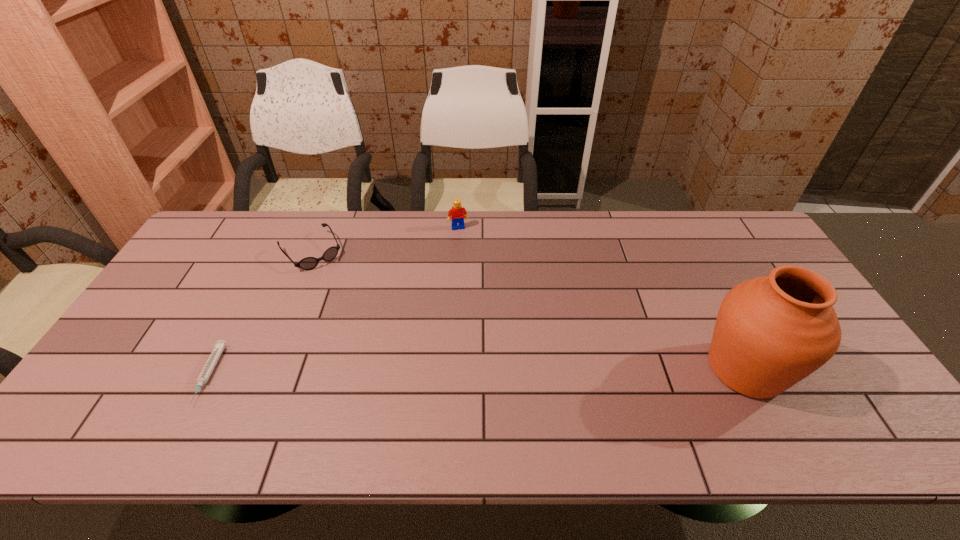
Identify the location of object located in the near right corner section of the desktop. This screenshot has width=960, height=540. (771, 332).

The width and height of the screenshot is (960, 540). In the image, there is a desktop. Find the location of `vacant space at the far edge`. vacant space at the far edge is located at coordinates (405, 230).

Find the location of a particular element. vacant area at the near edge of the desktop is located at coordinates (378, 388).

Image resolution: width=960 pixels, height=540 pixels. I want to click on vacant space at the left edge, so click(x=117, y=362).

Where is `vacant area at the far left corner`? This screenshot has height=540, width=960. vacant area at the far left corner is located at coordinates (236, 220).

Locate an element on the screen. The height and width of the screenshot is (540, 960). vacant area at the near right corner of the desktop is located at coordinates (833, 377).

Locate an element on the screen. This screenshot has width=960, height=540. empty space that is in between the shortest object and the second tallest object is located at coordinates (333, 301).

I want to click on free space between the urn and the third object from right to left, so click(528, 310).

This screenshot has width=960, height=540. In order to click on free space between the farthest object and the second object from left to right in this screenshot , I will do `click(385, 240)`.

At what (x,y) coordinates should I click in order to perform the action: click on vacant space that's between the third object from left to right and the syringe. Please return your answer as a coordinate pair (x, y). Image resolution: width=960 pixels, height=540 pixels. Looking at the image, I should click on (333, 301).